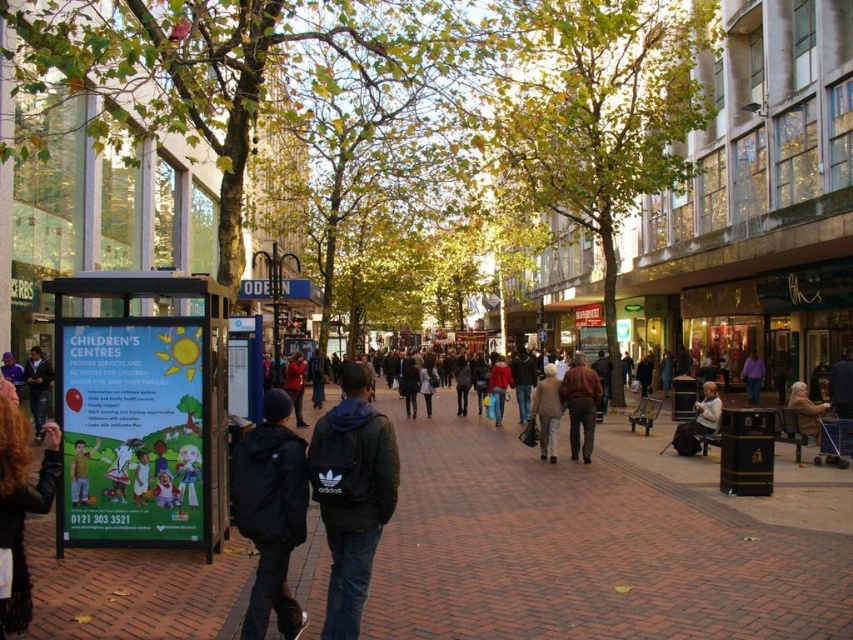
You are a pedestrian standing on the street and see the black adidas backpack at lower left and the red matte jacket at center. Which object is closer to the left side of the street?

The black adidas backpack at lower left is closer to the left side of the street because it is positioned to the left of the red matte jacket at center.

You are standing on the street and want to pick up your black adidas backpack at lower left which is 4.75 meters away from your current position. Can you reach it without moving your feet?

The black adidas backpack at lower left is 4.75 meters away from your current position, so you cannot reach it without moving your feet since that distance is too far for an arm reach.

You are a delivery person standing on the street and need to decide whether to place a large package between the black adidas backpack at center and the light beige fabric coat at center. Given that the package requires 1.2 meters of vertical space, can you fit it there?

The black adidas backpack at center is not as tall as the light beige fabric coat at center, but the exact height difference isn